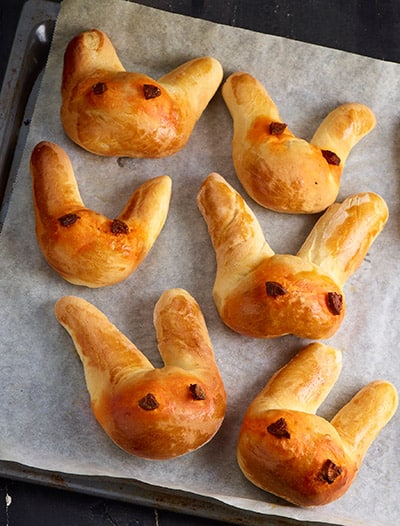
You are a GUI agent. You are given a task and a screenshot of the screen. Output one action in this format:
    pyautogui.click(x=<x>, y=<y>)
    Task: Click on the tray
    This screenshot has height=526, width=400.
    Given the screenshot: What is the action you would take?
    pyautogui.click(x=119, y=495)